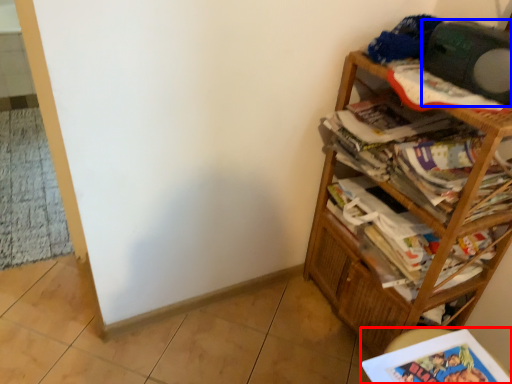
Question: Which object appears farthest to the camera in this image, book (highlighted by a red box) or speaker (highlighted by a blue box)?

Choices:
 (A) book
 (B) speaker

Answer: (B)